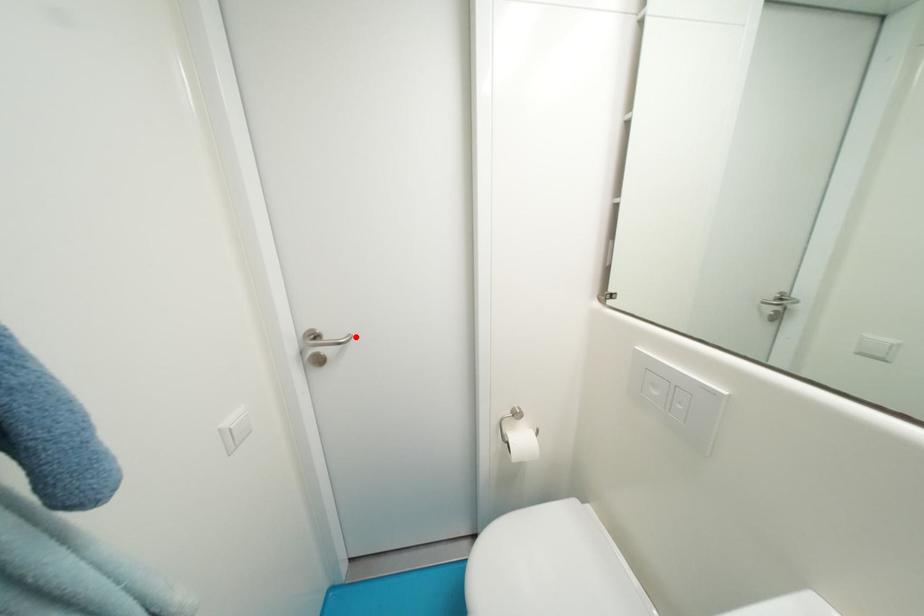
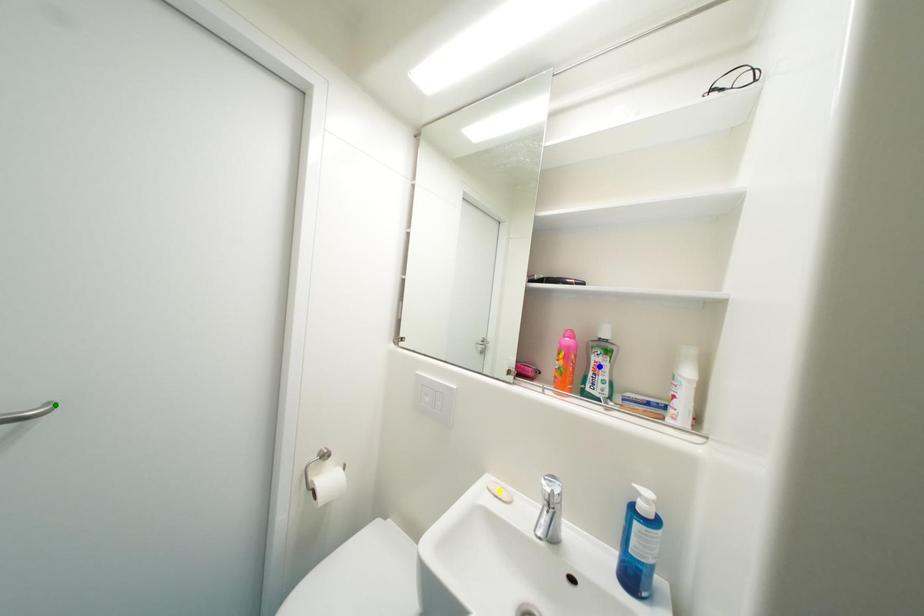
Question: I am providing you with two images of the same scene from different viewpoints. A red point is marked on the first image. You are given multiple points on the second image. Which spot in image 2 lines up with the point in image 1?

Choices:
 (A) green point
 (B) blue point
 (C) yellow point

Answer: (A)